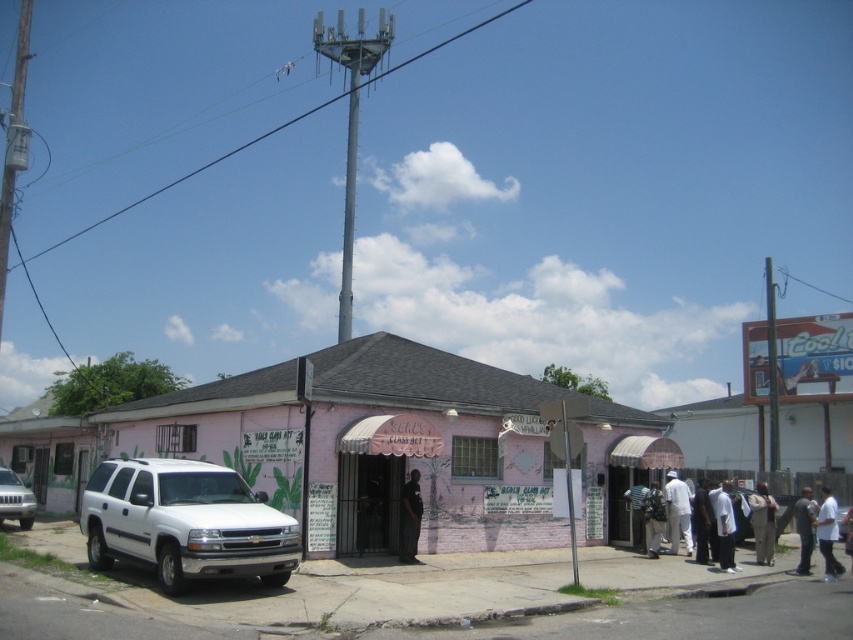
You are standing at the point marked by the coordinates (653, 518) in the image. What object is located exactly at your current position?

The dark gray backpack at center is located exactly at the coordinates (653, 518).

You are standing at the point marked by the coordinate point at (184, 522). Which object is directly behind you?

The white matte suv at lower left is located at point (184, 522), so the object directly behind you would be the pink building with a flat roof.